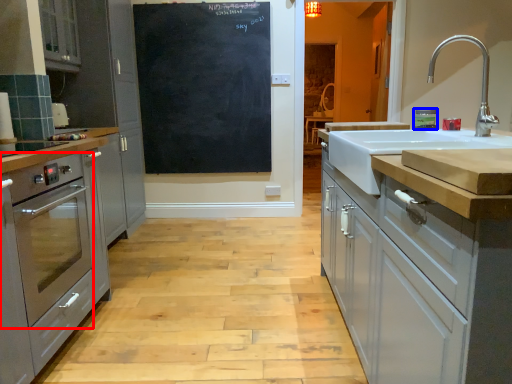
Question: Which object appears closest to the camera in this image, home appliance (highlighted by a red box) or appliance (highlighted by a blue box)?

Choices:
 (A) home appliance
 (B) appliance

Answer: (A)